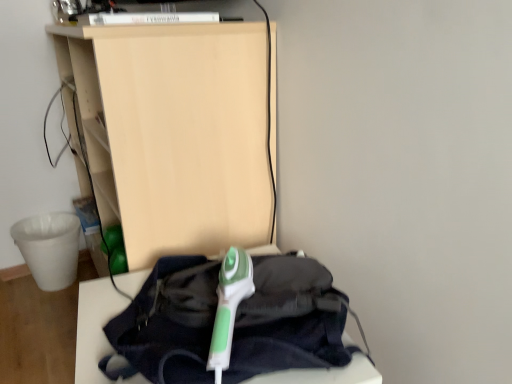
Question: Is point (96, 365) positioned closer to the camera than point (181, 236)?

Choices:
 (A) closer
 (B) farther

Answer: (A)

Question: Based on their sizes in the image, would you say green plastic iron at center, positioned as the 1th furniture in bottom-to-top order, is bigger or smaller than matte wood shelf at upper center, which is counted as the first furniture, starting from the top?

Choices:
 (A) big
 (B) small

Answer: (B)

Question: Considering the real-world distances, which object is farthest from the green plastic iron at center, which is the 2th furniture from top to bottom?

Choices:
 (A) green plastic iron at center
 (B) matte wood shelf at upper center, which is counted as the first furniture, starting from the top

Answer: (B)

Question: Which is farther from the green plastic iron at center, which is the 2th furniture from top to bottom?

Choices:
 (A) green plastic iron at center
 (B) matte wood shelf at upper center, the 2th furniture in the bottom-to-top sequence

Answer: (B)